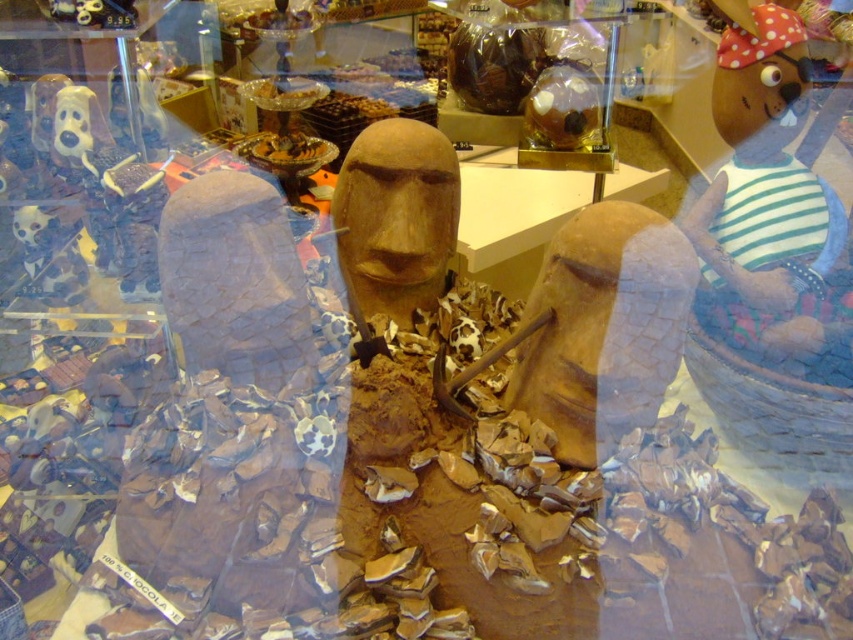
Can you confirm if striped fabric bear at upper right is bigger than matte brown statue at center?

Yes.

Is striped fabric bear at upper right to the right of matte brown statue at center from the viewer's perspective?

Correct, you'll find striped fabric bear at upper right to the right of matte brown statue at center.

Locate an element on the screen. striped fabric bear at upper right is located at coordinates (767, 196).

Find the location of a particular element. The width and height of the screenshot is (853, 640). striped fabric bear at upper right is located at coordinates (767, 196).